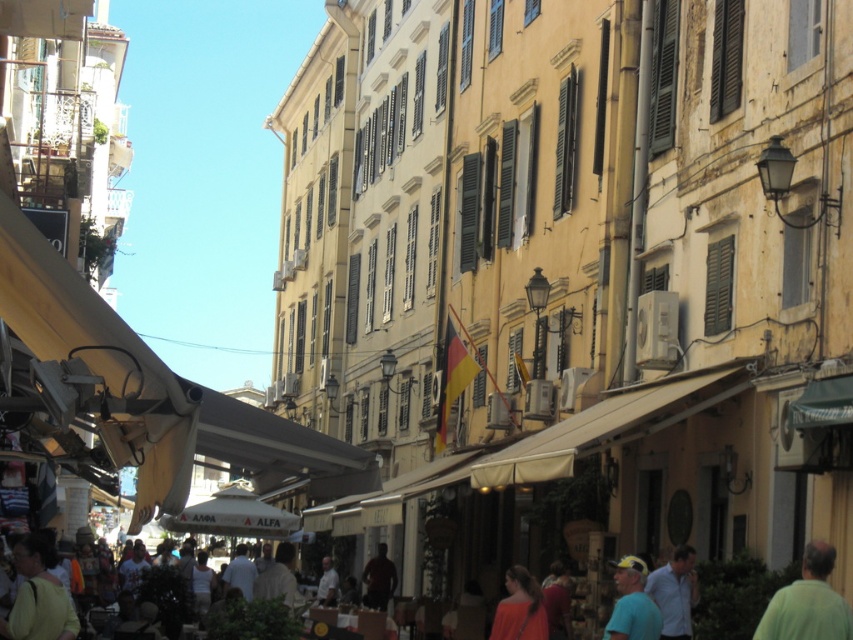
You are standing in the middle of the street and want to take a photo of both the point at coordinates (796, 616) and the point at (18, 557). Which point will appear larger in your photo?

The point at coordinates (796, 616) will appear larger in the photo because it is closer to the camera than the point at (18, 557).

In the scene shown: You are a photographer standing in the middle of the street, and you want to capture both the yellow cap at lower right and the light brown leather jacket at center in your photo. Which object will appear larger in the photo?

The yellow cap at lower right will appear larger in the photo because it is much taller than the light brown leather jacket at center.

You are a street performer who wants to carry both the green matte shirt at lower right and the light brown fabric bag at lower left. If you need to place them side by side in your backpack, which item should you place first to ensure they both fit?

The green matte shirt at lower right should be placed first since it has a smaller width than the light brown fabric bag at lower left, allowing more space for the larger item afterward.